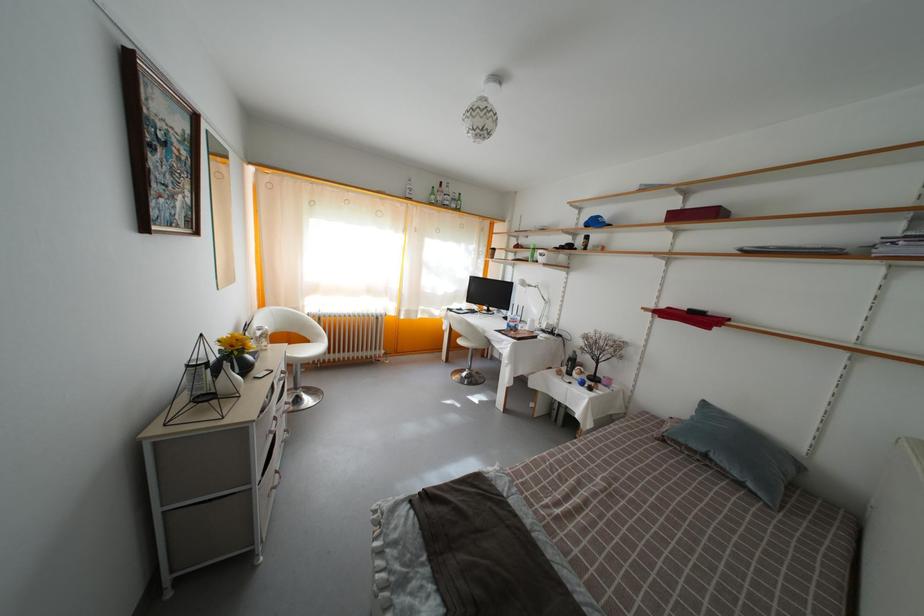
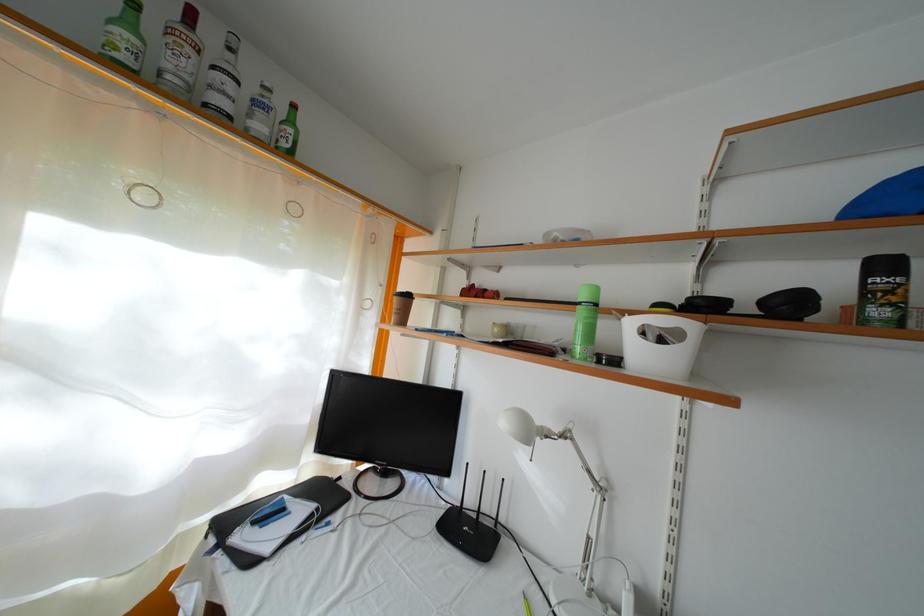
Where in the second image is the point corresponding to (592,244) from the first image?

(891, 273)